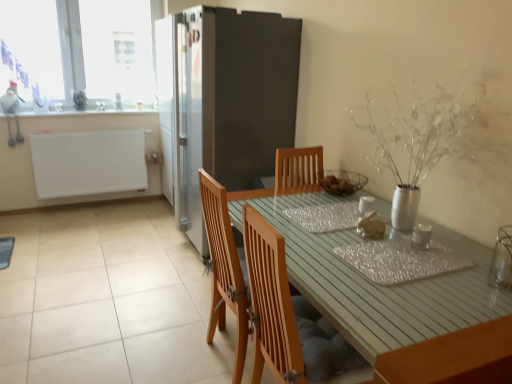
Where is `free space above white matte radiator at left (from a real-world perspective)`? The image size is (512, 384). free space above white matte radiator at left (from a real-world perspective) is located at coordinates (91, 128).